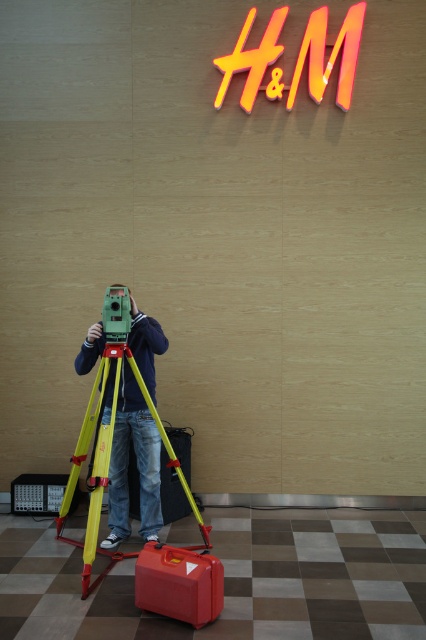
Does orange neon sign at upper center appear on the left side of matte red suitcase at lower center?

No, orange neon sign at upper center is not to the left of matte red suitcase at lower center.

Is orange neon sign at upper center thinner than matte red suitcase at lower center?

In fact, orange neon sign at upper center might be wider than matte red suitcase at lower center.

Between point (339, 88) and point (189, 609), which one is positioned in front?

Point (189, 609)

This screenshot has width=426, height=640. Identify the location of orange neon sign at upper center. pyautogui.click(x=330, y=54).

Can you confirm if yellow plastic tripod at center is smaller than red plastic suitcase at center?

Incorrect, yellow plastic tripod at center is not smaller in size than red plastic suitcase at center.

Does yellow plastic tripod at center appear under red plastic suitcase at center?

Incorrect, yellow plastic tripod at center is not positioned below red plastic suitcase at center.

Who is more distant from viewer, (x=169, y=445) or (x=135, y=483)?

The point (x=135, y=483) is behind.

You are a GUI agent. You are given a task and a screenshot of the screen. Output one action in this format:
    pyautogui.click(x=<x>, y=<y>)
    Task: Click on the yellow plastic tripod at center
    
    Given the screenshot: What is the action you would take?
    pyautogui.click(x=111, y=464)

Measure the distance between orange neon sign at upper center and camera.

orange neon sign at upper center is 4.48 meters from camera.

Does orange neon sign at upper center lie in front of red plastic suitcase at center?

No, it is not.

Does point (244, 100) come in front of point (175, 496)?

No, it is not.

You are a GUI agent. You are given a task and a screenshot of the screen. Output one action in this format:
    pyautogui.click(x=<x>, y=<y>)
    Task: Click on the orange neon sign at upper center
    The image size is (426, 640).
    Given the screenshot: What is the action you would take?
    pyautogui.click(x=330, y=54)